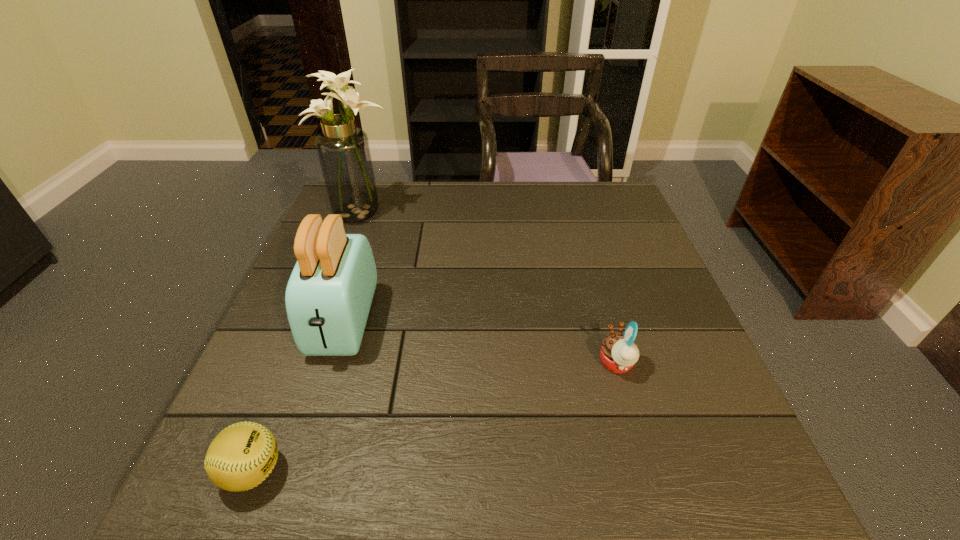
At what (x,y) coordinates should I click in order to perform the action: click on free spot between the rightmost object and the softball. Please return your answer as a coordinate pair (x, y). Image resolution: width=960 pixels, height=540 pixels. Looking at the image, I should click on (435, 417).

Image resolution: width=960 pixels, height=540 pixels. What are the coordinates of `vacant region between the softball and the third shortest object` in the screenshot? It's located at (299, 396).

Where is `empty location between the third shortest object and the rightmost object`? empty location between the third shortest object and the rightmost object is located at coordinates tap(480, 343).

Point out which object is positioned as the second nearest to the tallest object. Please provide its 2D coordinates. Your answer should be formatted as a tuple, i.e. [(x, y)], where the tuple contains the x and y coordinates of a point satisfying the conditions above.

[(241, 456)]

You are a GUI agent. You are given a task and a screenshot of the screen. Output one action in this format:
    pyautogui.click(x=<x>, y=<y>)
    Task: Click on the object that stands as the second closest to the flower arrangement
    This screenshot has height=540, width=960.
    Given the screenshot: What is the action you would take?
    pyautogui.click(x=241, y=456)

The height and width of the screenshot is (540, 960). In order to click on free space that satisfies the following two spatial constraints: 1. on the side of the second tallest object with the lever; 2. on the logo side of the softball in this screenshot , I will do `click(297, 471)`.

Where is `vacant space that satisfies the following two spatial constraints: 1. on the side of the toaster with the lever; 2. on the logo side of the nearest object`? vacant space that satisfies the following two spatial constraints: 1. on the side of the toaster with the lever; 2. on the logo side of the nearest object is located at coordinates (297, 471).